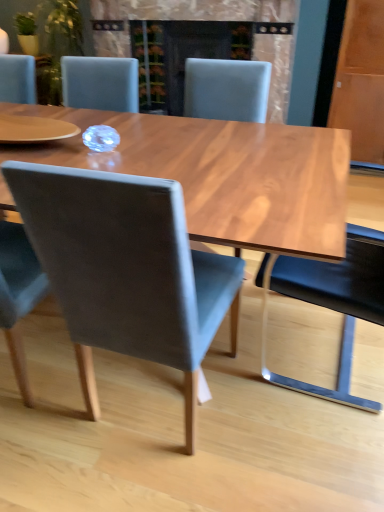
Question: Can you confirm if matte gray chair at center, which is the first chair from left to right, is taller than matte black fireplace at center?

Choices:
 (A) no
 (B) yes

Answer: (B)

Question: Is matte gray chair at center, the 4th chair from the right, located outside matte black fireplace at center?

Choices:
 (A) yes
 (B) no

Answer: (A)

Question: Is matte gray chair at center, the 4th chair from the right, in contact with matte black fireplace at center?

Choices:
 (A) yes
 (B) no

Answer: (B)

Question: Is there a large distance between matte gray chair at center, the 4th chair from the right, and matte black fireplace at center?

Choices:
 (A) no
 (B) yes

Answer: (B)

Question: From a real-world perspective, does matte gray chair at center, the 4th chair from the right, sit lower than matte black fireplace at center?

Choices:
 (A) no
 (B) yes

Answer: (B)

Question: Is matte gray chair at center, the 4th chair from the right, facing towards matte black fireplace at center?

Choices:
 (A) no
 (B) yes

Answer: (B)

Question: Is matte black fireplace at center directly adjacent to black leather chair at right, which is the 4th chair from left to right?

Choices:
 (A) yes
 (B) no

Answer: (B)

Question: Is matte black fireplace at center bigger than black leather chair at right, which ranks as the 1th chair in right-to-left order?

Choices:
 (A) no
 (B) yes

Answer: (B)

Question: Can you confirm if matte black fireplace at center is wider than black leather chair at right, which is the 4th chair from left to right?

Choices:
 (A) no
 (B) yes

Answer: (B)

Question: Can you confirm if matte black fireplace at center is thinner than black leather chair at right, which ranks as the 1th chair in right-to-left order?

Choices:
 (A) no
 (B) yes

Answer: (A)

Question: Is matte black fireplace at center far from black leather chair at right, which is the 4th chair from left to right?

Choices:
 (A) no
 (B) yes

Answer: (B)

Question: Can you confirm if matte black fireplace at center is positioned to the left of black leather chair at right, which ranks as the 1th chair in right-to-left order?

Choices:
 (A) no
 (B) yes

Answer: (B)

Question: From a real-world perspective, is black leather chair at right, which ranks as the 1th chair in right-to-left order, under matte black fireplace at center?

Choices:
 (A) yes
 (B) no

Answer: (A)